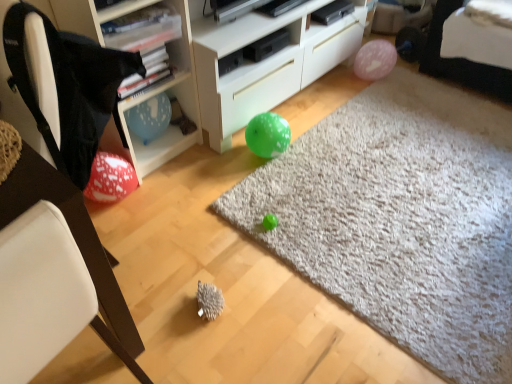
Question: In the image, is blue paper balloon at upper left positioned in front of or behind white plastic shelf at upper left?

Choices:
 (A) front
 (B) behind

Answer: (B)

Question: From a real-world perspective, is blue paper balloon at upper left physically located above or below white plastic shelf at upper left?

Choices:
 (A) above
 (B) below

Answer: (B)

Question: Which is farther from the green matte balloon at center?

Choices:
 (A) black fabric bean bag chair at left
 (B) blue paper balloon at upper left
 (C) pink matte balloon at upper right
 (D) white matte cabinet at center
 (E) white plastic shelf at upper left

Answer: (A)

Question: Estimate the real-world distances between objects in this image. Which object is farther from the white matte cabinet at center?

Choices:
 (A) green matte balloon at center
 (B) pink matte balloon at upper right
 (C) black fabric bean bag chair at left
 (D) blue paper balloon at upper left
 (E) white plastic chair at left

Answer: (E)